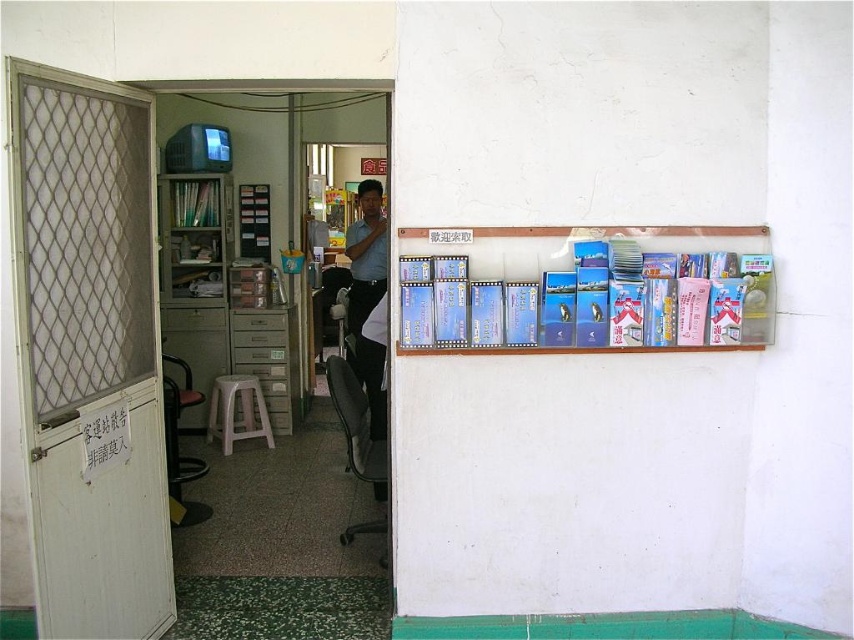
Does matte plastic bookshelf at left appear on the right side of clear plastic cards at upper right?

In fact, matte plastic bookshelf at left is to the left of clear plastic cards at upper right.

Does matte plastic bookshelf at left have a larger size compared to clear plastic cards at upper right?

Correct, matte plastic bookshelf at left is larger in size than clear plastic cards at upper right.

Is point (178, 289) farther from camera compared to point (428, 346)?

Yes, it is behind point (428, 346).

Find the location of a particular element. The image size is (854, 640). matte plastic bookshelf at left is located at coordinates (196, 276).

Between matte plastic bookshelf at left and white plastic stool at lower center, which one is positioned lower?

white plastic stool at lower center

What do you see at coordinates (196, 276) in the screenshot? The image size is (854, 640). I see `matte plastic bookshelf at left` at bounding box center [196, 276].

Where is `matte plastic bookshelf at left`? Image resolution: width=854 pixels, height=640 pixels. matte plastic bookshelf at left is located at coordinates (196, 276).

Between matte plastic bookshelf at left and matte blue shirt at center, which one has less height?

matte blue shirt at center

The width and height of the screenshot is (854, 640). I want to click on matte plastic bookshelf at left, so click(x=196, y=276).